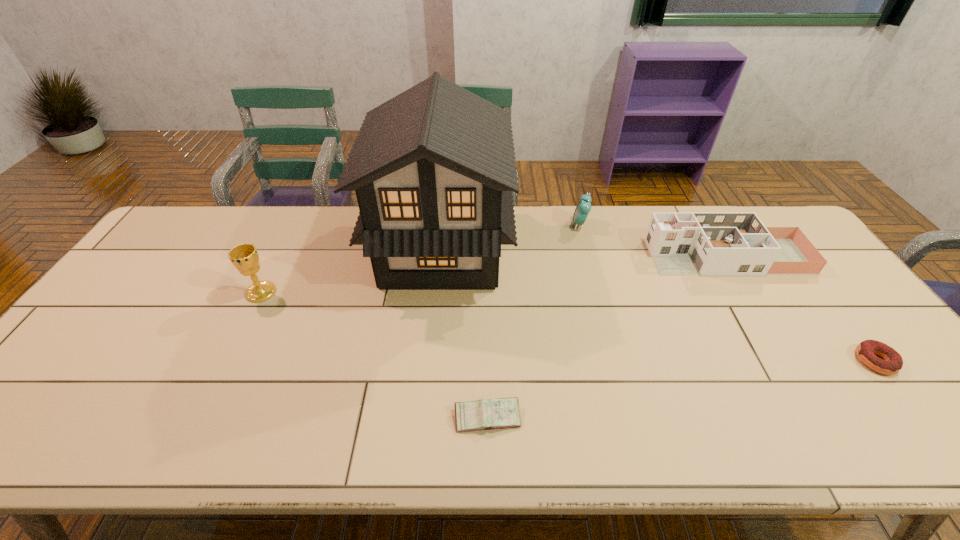
Identify the location of vacant point located between the doughnut and the chalice. The width and height of the screenshot is (960, 540). (568, 327).

Identify the location of vacant area that lies between the leftmost object and the second nearest object. (568, 327).

Where is `empty space between the diary and the shortest object`? empty space between the diary and the shortest object is located at coordinates (682, 389).

This screenshot has width=960, height=540. Identify the location of free space between the second nearest object and the right dollhouse. (802, 309).

Locate an element on the screen. vacant space that's between the diary and the shorter dollhouse is located at coordinates (608, 337).

You are a GUI agent. You are given a task and a screenshot of the screen. Output one action in this format:
    pyautogui.click(x=<x>, y=<y>)
    Task: Click on the free space that is in between the diary and the right dollhouse
    
    Given the screenshot: What is the action you would take?
    pyautogui.click(x=608, y=337)

This screenshot has width=960, height=540. I want to click on object that is the second closest to the third object from right to left, so click(433, 168).

Point out which object is positioned as the third nearest to the fifth shortest object. Please provide its 2D coordinates. Your answer should be formatted as a tuple, i.e. [(x, y)], where the tuple contains the x and y coordinates of a point satisfying the conditions above.

[(583, 207)]

The height and width of the screenshot is (540, 960). Find the location of `free space that satisfies the following two spatial constraints: 1. on the front-facing side of the taller dollhouse; 2. on the right side of the diary`. free space that satisfies the following two spatial constraints: 1. on the front-facing side of the taller dollhouse; 2. on the right side of the diary is located at coordinates (424, 417).

I want to click on free space that satisfies the following two spatial constraints: 1. on the back side of the shortest object; 2. on the right side of the nearest object, so click(x=487, y=361).